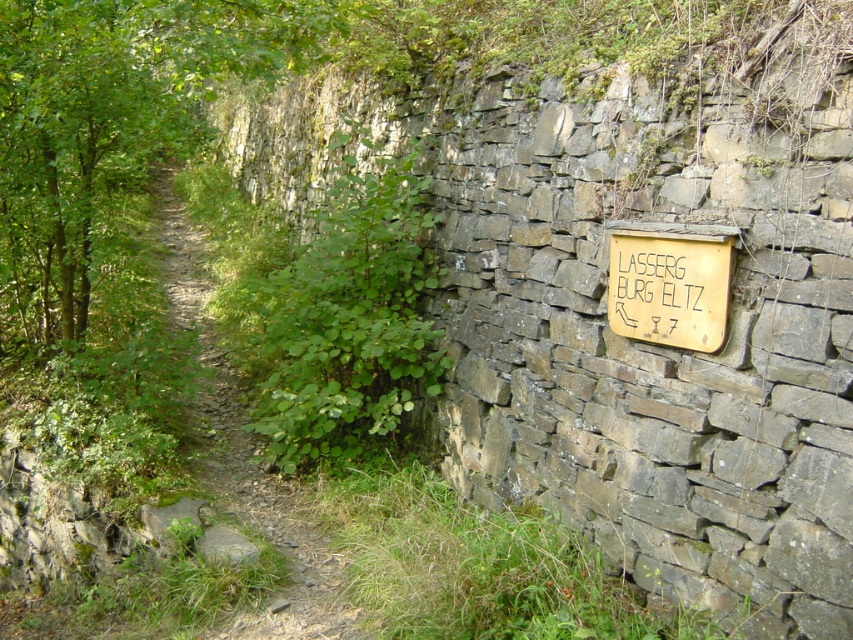
Question: Which point appears farthest from the camera in this image?

Choices:
 (A) (691, 262)
 (B) (82, 220)
 (C) (329, 602)

Answer: (B)

Question: Is dirt path at left above wooden sign at right?

Choices:
 (A) yes
 (B) no

Answer: (A)

Question: Which of the following is the farthest from the observer?

Choices:
 (A) green leafy tree at center
 (B) dirt path at left
 (C) wooden sign at right

Answer: (A)

Question: Where is green leafy tree at center located in relation to yellow paper sign at right in the image?

Choices:
 (A) left
 (B) right

Answer: (A)

Question: Can you confirm if green leafy tree at center is smaller than yellow paper sign at right?

Choices:
 (A) yes
 (B) no

Answer: (B)

Question: Which of the following is the farthest from the observer?

Choices:
 (A) wooden sign at right
 (B) dirt path at left

Answer: (B)